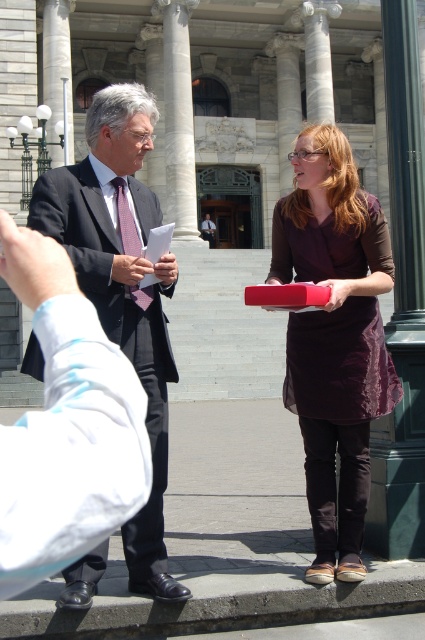
Question: Observing the image, what is the correct spatial positioning of matte purple dress at center in reference to matte black suit at left?

Choices:
 (A) below
 (B) above

Answer: (B)

Question: Which object is farther from the camera taking this photo?

Choices:
 (A) matte black suit at left
 (B) matte purple dress at center

Answer: (B)

Question: Which point is closer to the camera?

Choices:
 (A) matte purple dress at center
 (B) matte black suit at left

Answer: (B)

Question: Does matte purple dress at center have a smaller size compared to matte black suit at left?

Choices:
 (A) yes
 (B) no

Answer: (B)

Question: Where is matte purple dress at center located in relation to matte black suit at left in the image?

Choices:
 (A) above
 (B) below

Answer: (A)